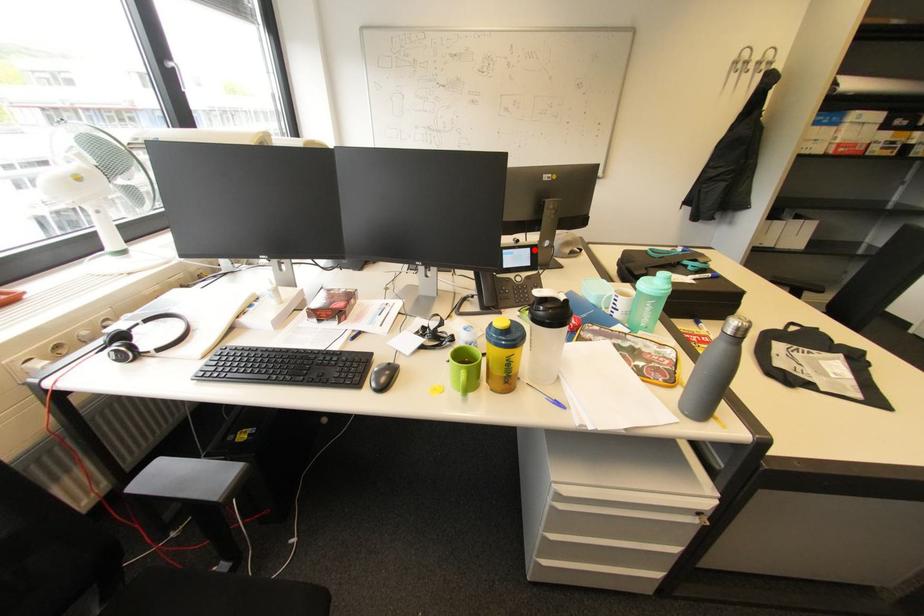
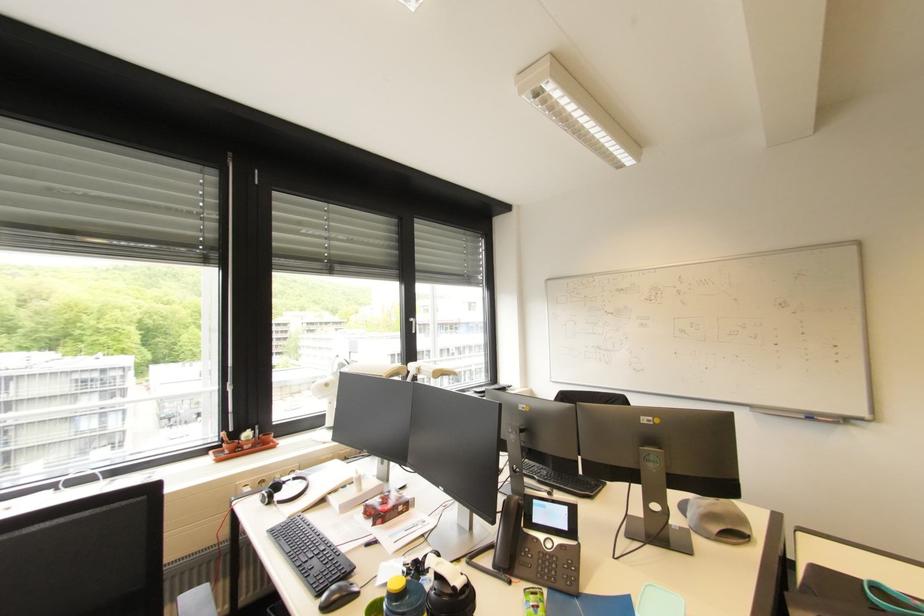
Question: I am providing you with two images of the same scene from different viewpoints. Given a red point in image1, look at the same physical point in image2. Is it:

Choices:
 (A) Closer to the viewpoint
 (B) Farther from the viewpoint

Answer: (A)